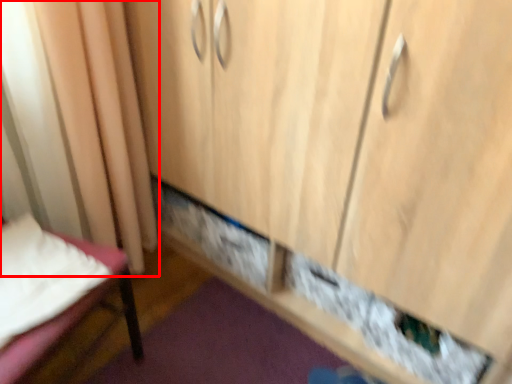
Question: From the image's perspective, where is curtain (annotated by the red box) located in relation to furniture in the image?

Choices:
 (A) above
 (B) below

Answer: (A)